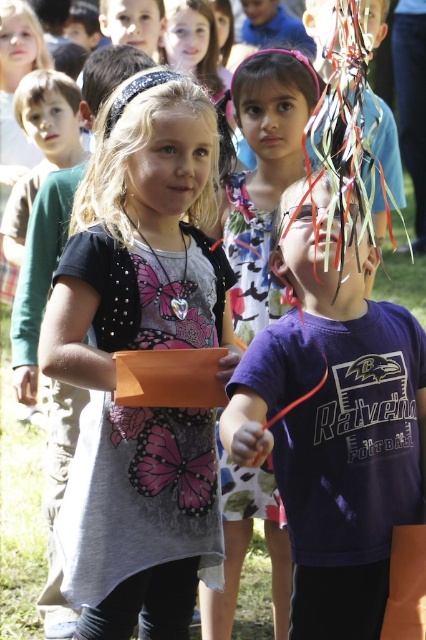
Can you confirm if matte gray dress at center is positioned to the left of purple cotton shirt at center?

Correct, you'll find matte gray dress at center to the left of purple cotton shirt at center.

You are a GUI agent. You are given a task and a screenshot of the screen. Output one action in this format:
    pyautogui.click(x=<x>, y=<y>)
    Task: Click on the matte gray dress at center
    This screenshot has height=640, width=426.
    Given the screenshot: What is the action you would take?
    pyautogui.click(x=141, y=349)

At what (x,y) coordinates should I click in order to perform the action: click on matte gray dress at center. Please return your answer as a coordinate pair (x, y). The height and width of the screenshot is (640, 426). Looking at the image, I should click on (141, 349).